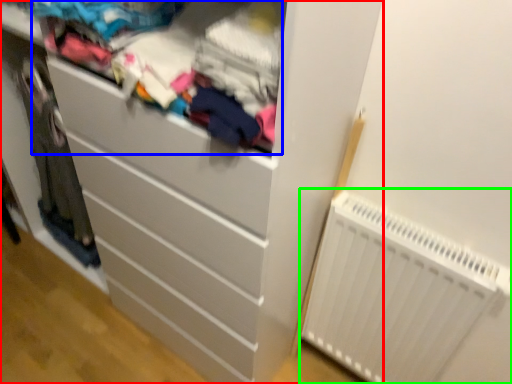
Question: Which object is the farthest from chest of drawers (highlighted by a red box)? Choose among these: clothing (highlighted by a blue box) or radiator (highlighted by a green box).

Choices:
 (A) clothing
 (B) radiator

Answer: (B)